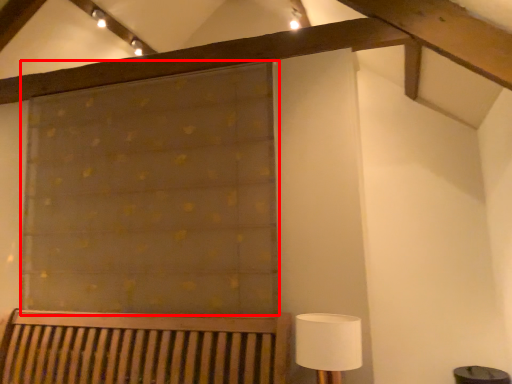
Question: From the image's perspective, considering the relative positions of curtain (annotated by the red box) and table lamp in the image provided, where is curtain (annotated by the red box) located with respect to the staircase?

Choices:
 (A) above
 (B) below

Answer: (A)